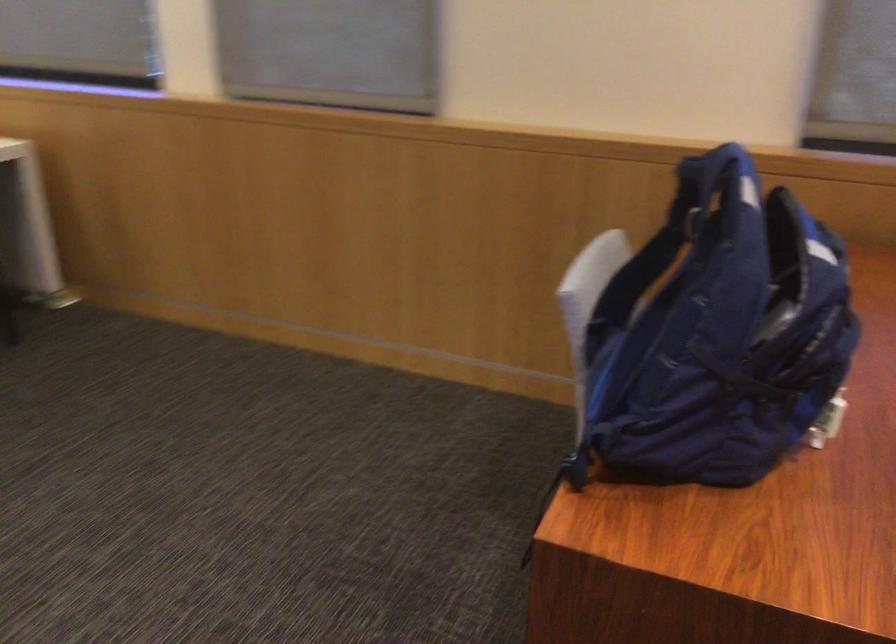
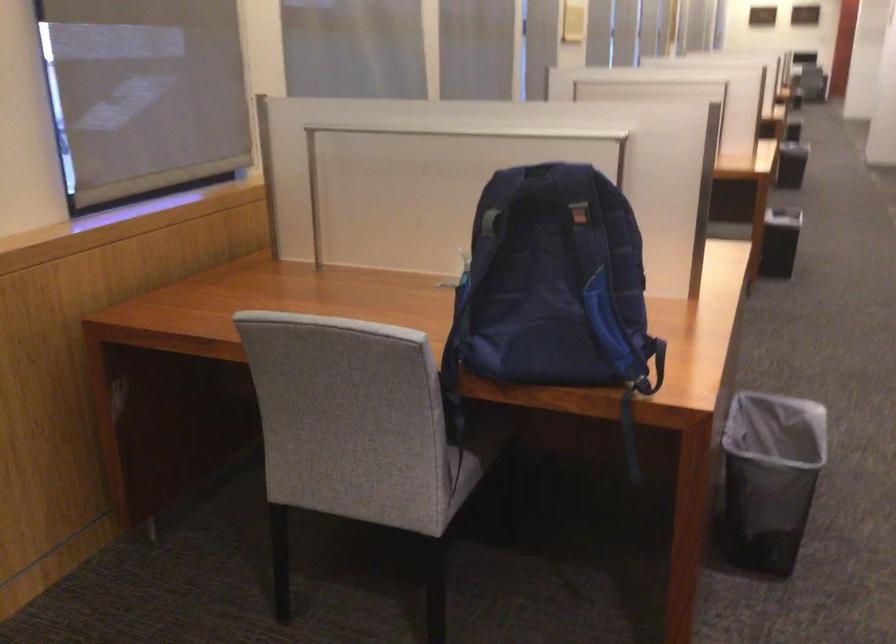
In the second image, find the point that corresponds to point 681,325 in the first image.

(552, 281)